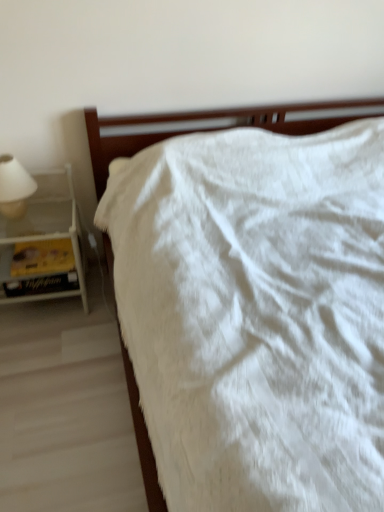
Question: Is yellow paper at left facing towards white fluffy blanket at center?

Choices:
 (A) no
 (B) yes

Answer: (A)

Question: Can you confirm if yellow paper at left is positioned to the left of white fluffy blanket at center?

Choices:
 (A) no
 (B) yes

Answer: (B)

Question: Is the depth of yellow paper at left greater than that of white fluffy blanket at center?

Choices:
 (A) yes
 (B) no

Answer: (A)

Question: From a real-world perspective, is yellow paper at left under white fluffy blanket at center?

Choices:
 (A) no
 (B) yes

Answer: (B)

Question: Is yellow paper at left facing away from white fluffy blanket at center?

Choices:
 (A) yes
 (B) no

Answer: (B)

Question: Is point (29, 179) positioned closer to the camera than point (92, 117)?

Choices:
 (A) closer
 (B) farther

Answer: (B)

Question: Considering the positions of white matte lampshade at left and white fluffy blanket at center in the image, is white matte lampshade at left taller or shorter than white fluffy blanket at center?

Choices:
 (A) tall
 (B) short

Answer: (B)

Question: Looking at their shapes, would you say white matte lampshade at left is wider or thinner than white fluffy blanket at center?

Choices:
 (A) thin
 (B) wide

Answer: (A)

Question: Do you think white matte lampshade at left is within white fluffy blanket at center, or outside of it?

Choices:
 (A) outside
 (B) inside

Answer: (A)

Question: In terms of width, does white fluffy blanket at center look wider or thinner when compared to yellow paper at left?

Choices:
 (A) wide
 (B) thin

Answer: (A)

Question: From the image's perspective, is white fluffy blanket at center positioned above or below yellow paper at left?

Choices:
 (A) above
 (B) below

Answer: (A)

Question: Considering the positions of white fluffy blanket at center and yellow paper at left in the image, is white fluffy blanket at center bigger or smaller than yellow paper at left?

Choices:
 (A) big
 (B) small

Answer: (A)

Question: From a real-world perspective, is white fluffy blanket at center physically located above or below yellow paper at left?

Choices:
 (A) below
 (B) above

Answer: (B)

Question: In the image, is yellow paper at left positioned in front of or behind white fluffy blanket at center?

Choices:
 (A) behind
 (B) front

Answer: (A)

Question: Do you think yellow paper at left is within white fluffy blanket at center, or outside of it?

Choices:
 (A) outside
 (B) inside

Answer: (A)